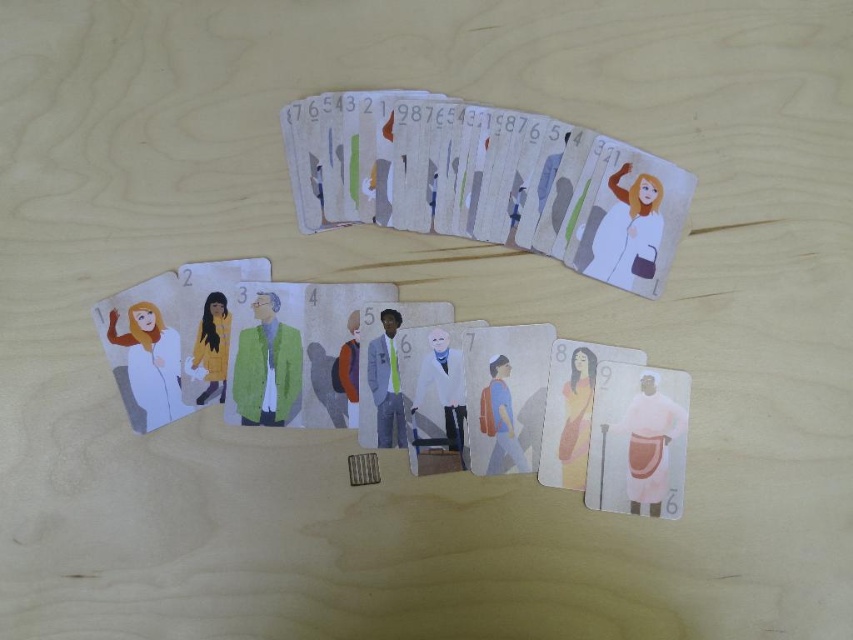
You are holding a marker and want to draw a dot exactly at point (149,362) on the matte white coat at left. Is the point on the coat?

Result: Yes, the point (149,362) is on the matte white coat at left, so you can draw the dot there.

You are organizing a card game and need to place the green textured sweater at center on top of the matte paper cards at center. Is this possible given their current positions?

The matte paper cards at center is located above the green textured sweater at center, so to place the green textured sweater at center on top of the matte paper cards at center, you would need to move the sweater upwards to position it above the cards.

You are looking at the cards arranged on the wooden surface. There are two points marked on the image, one at point (646,253) and another at point (279,355). Which point is closer to you?

Point (646,253) is closer to the viewer than point (279,355).